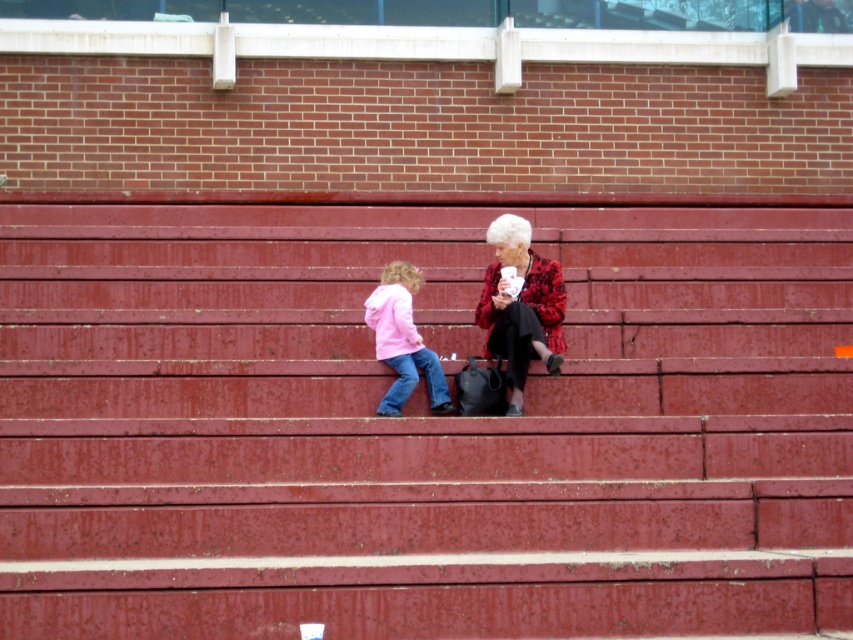
You are trying to determine if the smooth red stairs at center can support the weight of the red plaid jacket at center. Based on their height difference, can you infer anything about their ability to support weight?

The smooth red stairs at center is not as tall as the red plaid jacket at center, but height does not directly indicate weight capacity. The stairs are likely designed to support people, so they can handle the jacket easily.

You are a photographer trying to capture both the red plaid jacket at center and the matte pink jacket at lower left in the same frame. The camera you are using has a maximum focus range of 28 inches. Will you be able to include both jackets in your photo?

The red plaid jacket at center and the matte pink jacket at lower left are 27.85 inches apart, which is within the camera maximum focus range of 28 inches. Therefore, you can include both jackets in your photo.